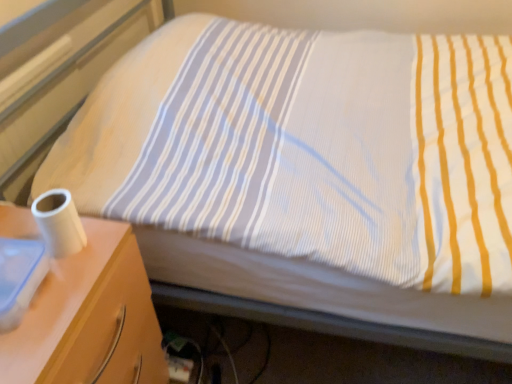
This screenshot has width=512, height=384. I want to click on white matte toilet paper at left, so click(59, 222).

The image size is (512, 384). What do you see at coordinates (59, 222) in the screenshot?
I see `white matte toilet paper at left` at bounding box center [59, 222].

You are a GUI agent. You are given a task and a screenshot of the screen. Output one action in this format:
    pyautogui.click(x=<x>, y=<y>)
    Task: Click on the white glossy nightstand at left
    
    Given the screenshot: What is the action you would take?
    pyautogui.click(x=89, y=317)

Image resolution: width=512 pixels, height=384 pixels. Describe the element at coordinates (89, 317) in the screenshot. I see `white glossy nightstand at left` at that location.

Locate an element on the screen. This screenshot has height=384, width=512. white matte toilet paper at left is located at coordinates (59, 222).

Between white glossy nightstand at left and white matte toilet paper at left, which one appears on the left side from the viewer's perspective?

From the viewer's perspective, white glossy nightstand at left appears more on the left side.

Which object is closer to the camera taking this photo, white glossy nightstand at left or white matte toilet paper at left?

white glossy nightstand at left is closer to the camera.

Which is in front, point (59, 367) or point (76, 244)?

The point (59, 367) is closer.

From the image's perspective, is white glossy nightstand at left above white matte toilet paper at left?

No, from the image's perspective, white glossy nightstand at left is not on top of white matte toilet paper at left.

From a real-world perspective, is white glossy nightstand at left above or below white matte toilet paper at left?

Result: Clearly, from a real-world perspective, white glossy nightstand at left is below white matte toilet paper at left.

Does white glossy nightstand at left have a greater width compared to white matte toilet paper at left?

Yes, white glossy nightstand at left is wider than white matte toilet paper at left.

Who is taller, white glossy nightstand at left or white matte toilet paper at left?

Standing taller between the two is white glossy nightstand at left.

Based on their sizes in the image, would you say white glossy nightstand at left is bigger or smaller than white matte toilet paper at left?

white glossy nightstand at left is bigger than white matte toilet paper at left.

Can we say white glossy nightstand at left lies outside white matte toilet paper at left?

Yes, white glossy nightstand at left is not within white matte toilet paper at left.

Would you say white glossy nightstand at left is a long distance from white matte toilet paper at left?

No.

Is white glossy nightstand at left turned away from white matte toilet paper at left?

No, white glossy nightstand at left is not facing away from white matte toilet paper at left.

What's the angular difference between white glossy nightstand at left and white matte toilet paper at left's facing directions?

0.00653 degrees separate the facing orientations of white glossy nightstand at left and white matte toilet paper at left.

How much distance is there between white glossy nightstand at left and white matte toilet paper at left?

white glossy nightstand at left and white matte toilet paper at left are 5.56 inches apart.

This screenshot has width=512, height=384. I want to click on nightstand that appears in front of the white matte toilet paper at left, so click(x=89, y=317).

Considering the relative positions of white matte toilet paper at left and white glossy nightstand at left in the image provided, is white matte toilet paper at left to the right of white glossy nightstand at left from the viewer's perspective?

Indeed, white matte toilet paper at left is positioned on the right side of white glossy nightstand at left.

Is the depth of white matte toilet paper at left less than that of white glossy nightstand at left?

No.

Is point (36, 200) farther from viewer compared to point (110, 254)?

No, it is not.

From the image's perspective, which one is positioned higher, white matte toilet paper at left or white glossy nightstand at left?

white matte toilet paper at left.

From a real-world perspective, does white matte toilet paper at left sit lower than white glossy nightstand at left?

Actually, white matte toilet paper at left is physically above white glossy nightstand at left in the real world.

Considering the relative sizes of white matte toilet paper at left and white glossy nightstand at left in the image provided, is white matte toilet paper at left thinner than white glossy nightstand at left?

Correct, the width of white matte toilet paper at left is less than that of white glossy nightstand at left.

Which of these two, white matte toilet paper at left or white glossy nightstand at left, stands shorter?

With less height is white matte toilet paper at left.

Is white matte toilet paper at left bigger or smaller than white glossy nightstand at left?

In the image, white matte toilet paper at left appears to be smaller than white glossy nightstand at left.

Could white glossy nightstand at left be considered to be inside white matte toilet paper at left?

No, white glossy nightstand at left is not a part of white matte toilet paper at left.

Is white matte toilet paper at left far from white glossy nightstand at left?

Actually, white matte toilet paper at left and white glossy nightstand at left are a little close together.

Consider the image. Is white matte toilet paper at left oriented towards white glossy nightstand at left?

No, white matte toilet paper at left is not turned towards white glossy nightstand at left.

How many degrees apart are the facing directions of white matte toilet paper at left and white glossy nightstand at left?

0.00653 degrees separate the facing orientations of white matte toilet paper at left and white glossy nightstand at left.

Where is `toilet paper behind the white glossy nightstand at left`? The image size is (512, 384). toilet paper behind the white glossy nightstand at left is located at coordinates (59, 222).

The image size is (512, 384). In order to click on toilet paper above the white glossy nightstand at left (from the image's perspective) in this screenshot , I will do `click(59, 222)`.

Locate an element on the screen. nightstand that is on the left side of white matte toilet paper at left is located at coordinates (89, 317).